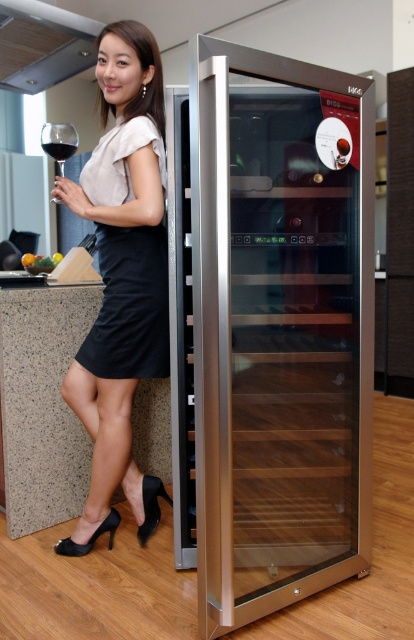
You are a chef preparing a salad and need to reach the green leafy vegetables at left. You are currently standing 6 feet away from the wine storage unit. Can you estimate if you can grab them without moving closer?

The green leafy vegetables at left are 8.78 feet away from the viewer. Since you are 6 feet away from the wine storage unit, you might still need to move closer to reach them as the distance between you and the vegetables is greater than your current position.

A woman is standing near a wine storage unit. How far apart are the woman and the satin silver wine cooler at right?

The woman and the satin silver wine cooler at right are 4.57 feet apart.

You are a bartender preparing to place a new wine glass on the counter. You notice the satin silver wine cooler at right and the transparent glass wine glass at left. Which object is located below the other?

The satin silver wine cooler at right is positioned under the transparent glass wine glass at left, so the wine cooler is below the wine glass.